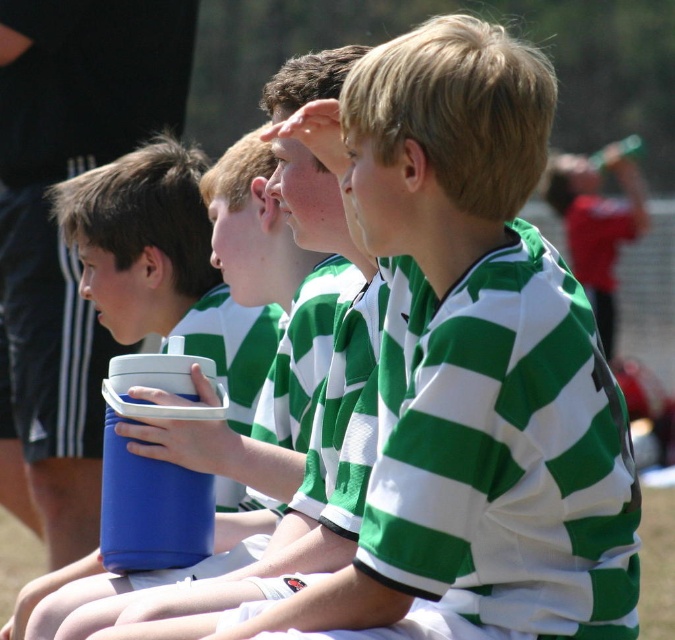
You are a photographer taking a picture of the blue plastic thermos at center. The camera you are using has a focus point at coordinate point [163,264]. Will the focus point align with the blue plastic thermos at center?

Yes, the focus point at coordinate point [163,264] aligns with the blue plastic thermos at center because the point marks the location of the thermos.

From the picture: You are a photographer trying to capture the blue plastic thermos at center in a closeup shot. Based on its coordinates, where should you aim your camera?

The blue plastic thermos at center is located at coordinates point (163, 264), so aim your camera there to capture it in a closeup shot.